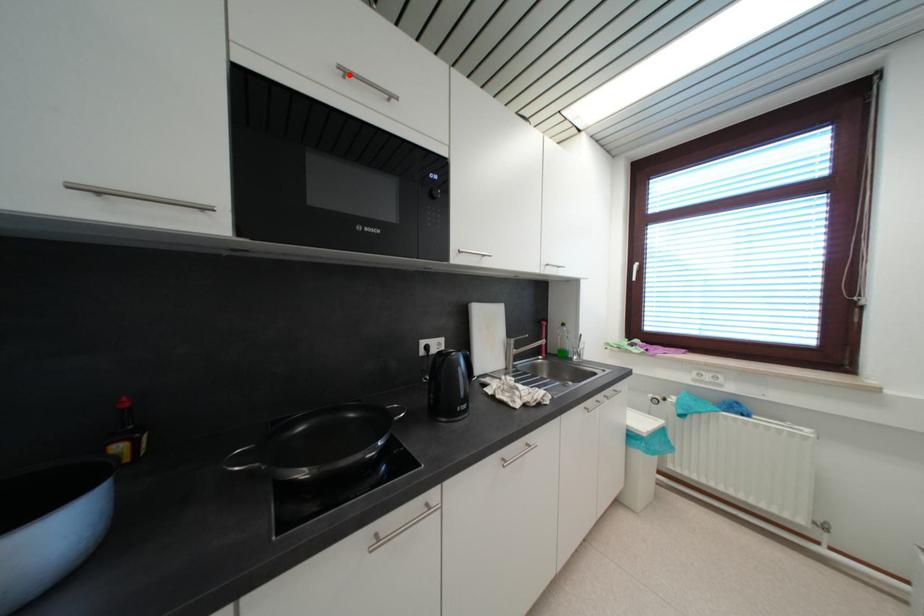
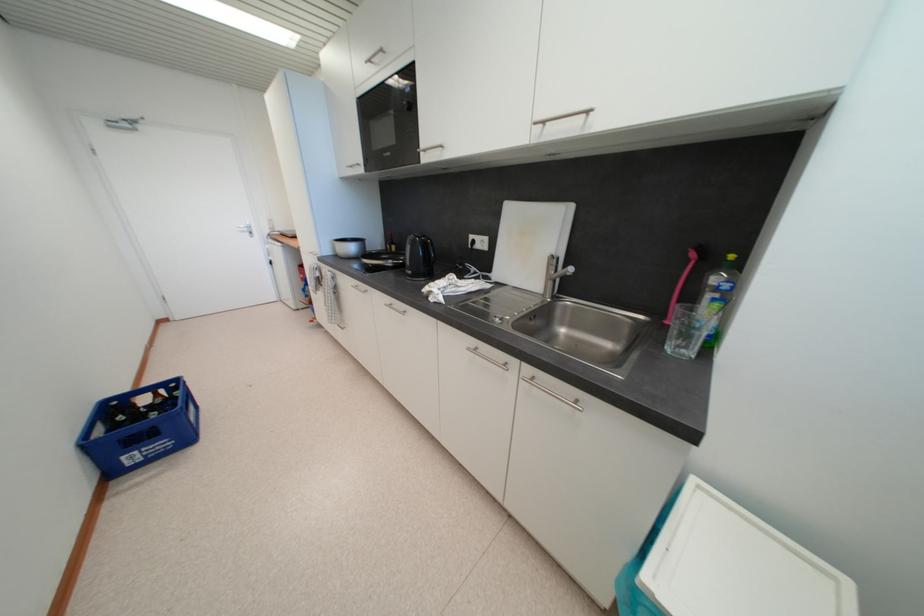
Question: I am providing you with two images of the same scene from different viewpoints. A red point is marked on the first image. At the location where the point appears in image 1, is it still visible in image 2?

Choices:
 (A) Yes
 (B) No

Answer: (A)